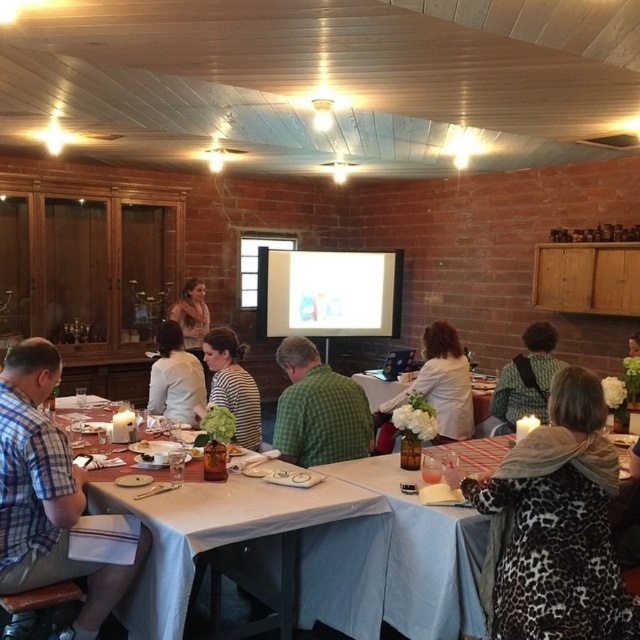
Does leopard print coat at lower right have a larger size compared to white fabric table at center?

Yes.

Between leopard print coat at lower right and white fabric table at center, which one is positioned lower?

leopard print coat at lower right is lower down.

Does point (544, 579) come farther from viewer compared to point (362, 378)?

No, (544, 579) is closer to viewer.

Locate an element on the screen. The image size is (640, 640). leopard print coat at lower right is located at coordinates (554, 525).

What do you see at coordinates (232, 385) in the screenshot?
I see `striped shirt at center` at bounding box center [232, 385].

Between point (257, 406) and point (189, 308), which one is positioned in front?

Point (257, 406) is more forward.

Image resolution: width=640 pixels, height=640 pixels. Find the location of `striped shirt at center`. striped shirt at center is located at coordinates (232, 385).

Is point (36, 376) closer to viewer compared to point (188, 339)?

Yes, it is.

Does plaid shirt at left appear under matte brown shirt at center?

Correct, plaid shirt at left is located below matte brown shirt at center.

Which is behind, point (4, 566) or point (184, 317)?

Positioned behind is point (184, 317).

This screenshot has width=640, height=640. Identify the location of plaid shirt at left. (45, 492).